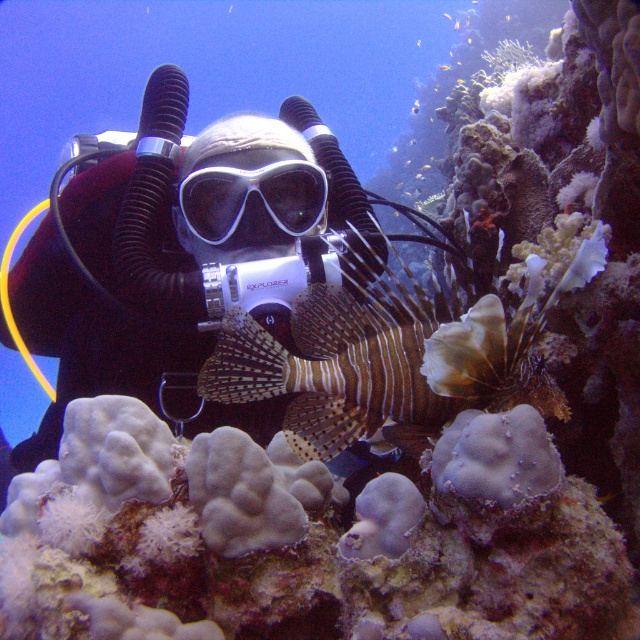
Question: Which of these objects is positioned farthest from the white matte scuba mask at center?

Choices:
 (A) brown striped fish at center
 (B) matte black diving suit at center
 (C) translucent yellow fish at center

Answer: (C)

Question: Based on their relative distances, which object is farther from the matte black diving suit at center?

Choices:
 (A) translucent yellow fish at center
 (B) white matte scuba mask at center

Answer: (A)

Question: Can you confirm if matte black diving suit at center is positioned above brown striped fish at center?

Choices:
 (A) yes
 (B) no

Answer: (B)

Question: Among these points, which one is nearest to the camera?

Choices:
 (A) (128, 365)
 (B) (218, 170)
 (C) (422, 204)

Answer: (B)

Question: Is matte black diving suit at center positioned in front of translucent yellow fish at center?

Choices:
 (A) no
 (B) yes

Answer: (B)

Question: Is brown striped fish at center to the right of translucent yellow fish at center from the viewer's perspective?

Choices:
 (A) no
 (B) yes

Answer: (A)